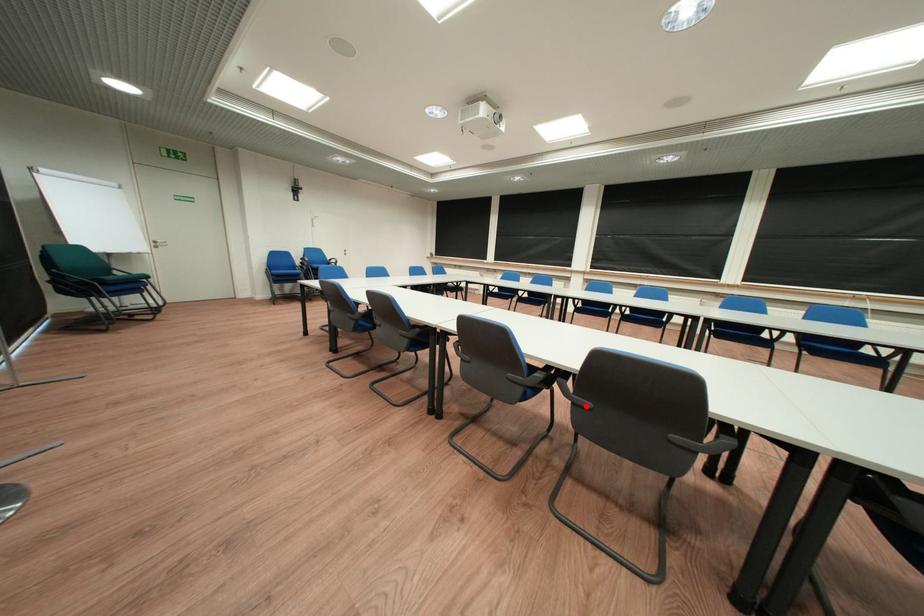
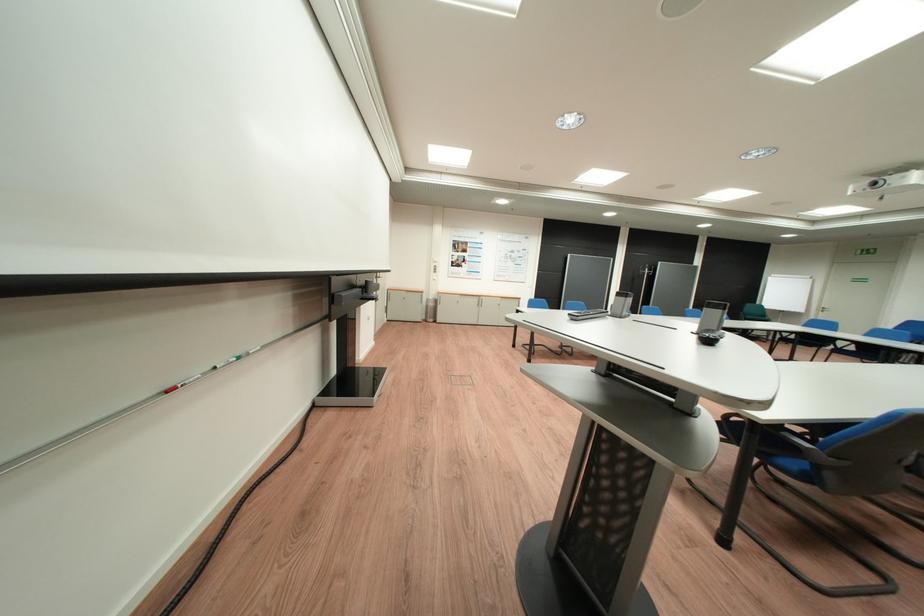
Question: I am providing you with two images of the same scene from different viewpoints. A red point is marked on the first image. At the location where the point appears in image 1, is it still visible in image 2?

Choices:
 (A) Yes
 (B) No

Answer: (B)